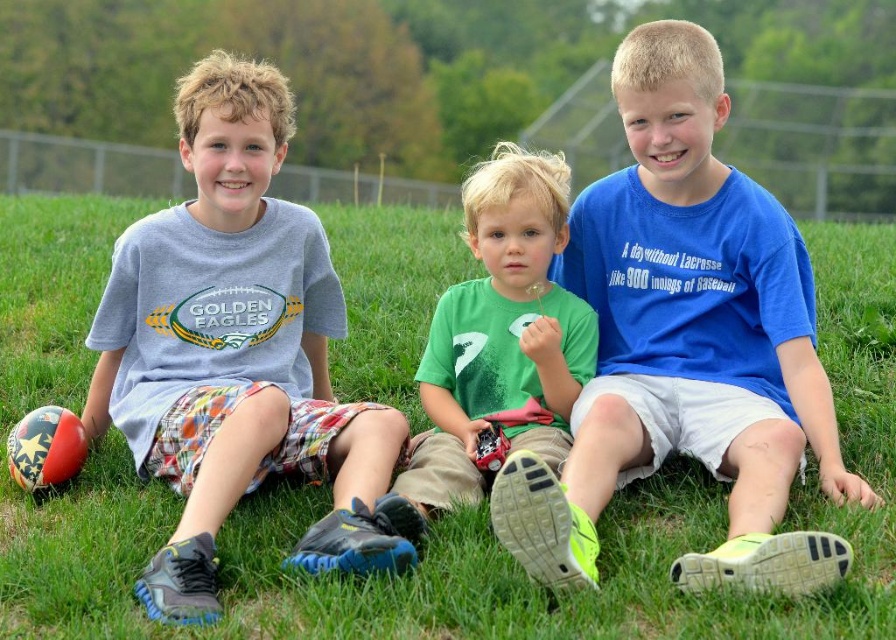
What are the coordinates of the green grass at center?

The coordinates of the green grass at center are at point [431,522].